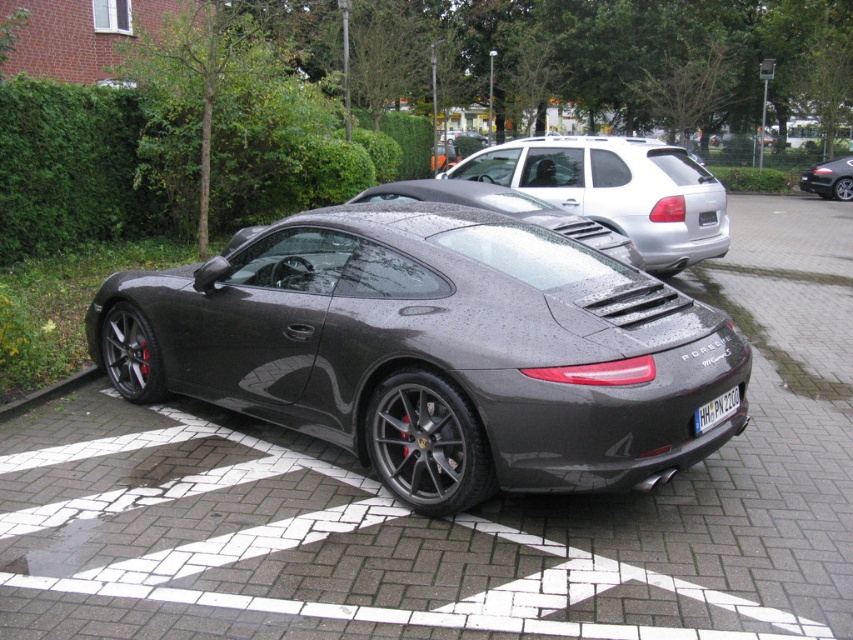
Does shiny black car at center appear on the left side of gray concrete curb at lower left?

Incorrect, shiny black car at center is not on the left side of gray concrete curb at lower left.

Does point (811, 164) come behind point (1, 419)?

Yes, point (811, 164) is behind point (1, 419).

Identify the location of shiny black car at center. (828, 179).

Does satin silver metallic suv at upper right have a smaller size compared to black plastic license plate at center?

Incorrect, satin silver metallic suv at upper right is not smaller in size than black plastic license plate at center.

Is satin silver metallic suv at upper right to the right of black plastic license plate at center from the viewer's perspective?

Correct, you'll find satin silver metallic suv at upper right to the right of black plastic license plate at center.

Is point (663, 150) positioned after point (722, 394)?

Yes, it is behind point (722, 394).

Find the location of `satin silver metallic suv at upper right`. satin silver metallic suv at upper right is located at coordinates (618, 189).

Is point (521, 154) less distant than point (97, 371)?

That is False.

How distant is satin silver metallic suv at upper right from gray concrete curb at lower left?

satin silver metallic suv at upper right and gray concrete curb at lower left are 17.70 feet apart.

The image size is (853, 640). Identify the location of satin silver metallic suv at upper right. click(618, 189).

Locate an element on the screen. The image size is (853, 640). satin silver metallic suv at upper right is located at coordinates (618, 189).